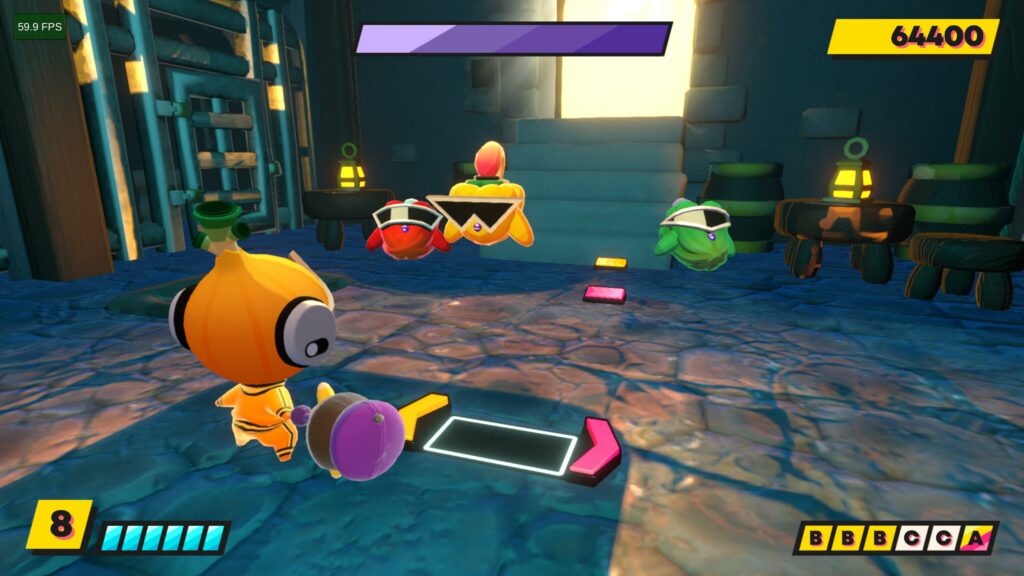
The image size is (1024, 576). I want to click on blue area on floor, so click(319, 521).